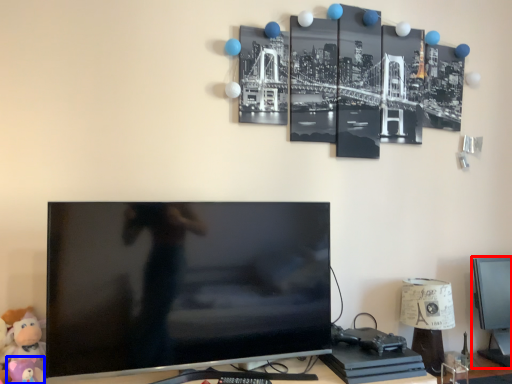
Question: Among these objects, which one is farthest to the camera, computer monitor (highlighted by a red box) or toy (highlighted by a blue box)?

Choices:
 (A) computer monitor
 (B) toy

Answer: (A)